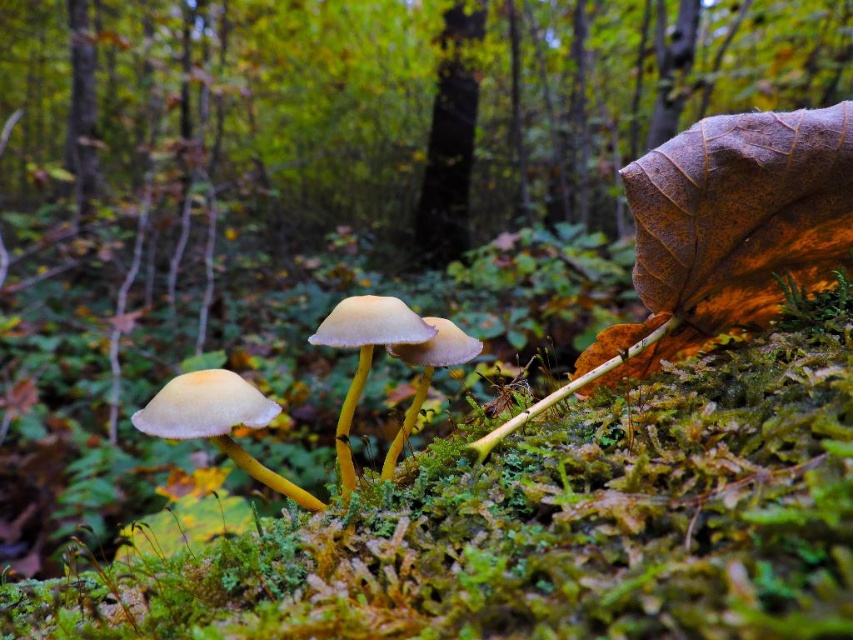
Question: Which point appears farthest from the camera in this image?

Choices:
 (A) (447, 144)
 (B) (612, 0)

Answer: (B)

Question: Is brown leaf at upper right bigger than smooth bark tree at center?

Choices:
 (A) no
 (B) yes

Answer: (B)

Question: Can you confirm if brown leaf at upper right is bigger than smooth bark tree at center?

Choices:
 (A) yes
 (B) no

Answer: (A)

Question: Which of the following is the closest to the observer?

Choices:
 (A) click(x=343, y=195)
 (B) click(x=451, y=32)

Answer: (A)

Question: Can you confirm if brown leaf at upper right is wider than smooth bark tree at center?

Choices:
 (A) yes
 (B) no

Answer: (A)